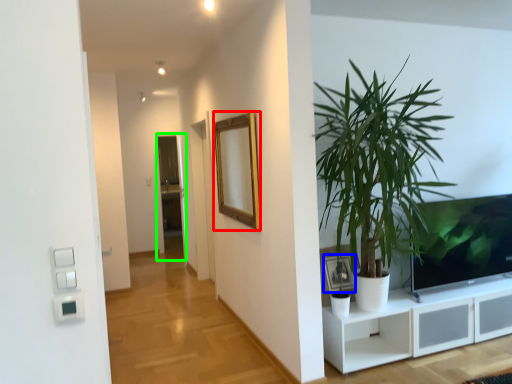
Question: Which is farther away from mirror (highlighted by a red box)? picture frame (highlighted by a blue box) or glass door (highlighted by a green box)?

Choices:
 (A) picture frame
 (B) glass door

Answer: (B)